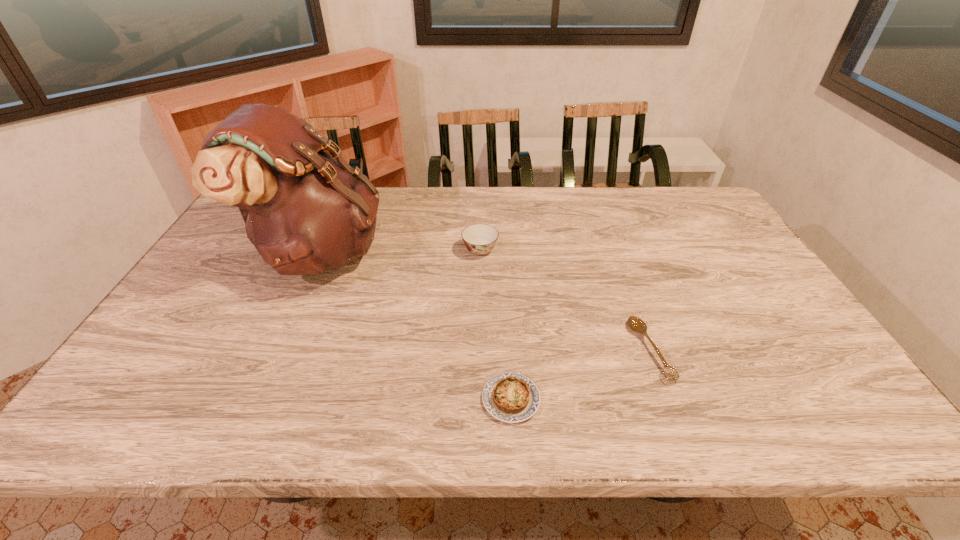
The image size is (960, 540). In order to click on free space between the second tallest object and the satchel in this screenshot , I will do `click(400, 252)`.

Identify the location of free point between the soup bowl and the ladle. This screenshot has height=540, width=960. (564, 300).

At what (x,y) coordinates should I click in order to perform the action: click on free space between the quiche and the third shortest object. Please return your answer as a coordinate pair (x, y). The height and width of the screenshot is (540, 960). Looking at the image, I should click on (495, 325).

This screenshot has width=960, height=540. What are the coordinates of `vacant space that's between the rightmost object and the third shortest object` in the screenshot? It's located at (564, 300).

You are a GUI agent. You are given a task and a screenshot of the screen. Output one action in this format:
    pyautogui.click(x=<x>, y=<y>)
    Task: Click on the free point between the tallest object and the soup bowl
    
    Given the screenshot: What is the action you would take?
    pyautogui.click(x=400, y=252)

Locate an element on the screen. free space between the third shortest object and the rightmost object is located at coordinates (564, 300).

Locate an element on the screen. vacant area that lies between the soup bowl and the quiche is located at coordinates (495, 325).

Find the location of a particular element. The image size is (960, 540). blank region between the quiche and the soup bowl is located at coordinates (495, 325).

This screenshot has width=960, height=540. Find the location of `object that stands as the second closest to the rightmost object`. object that stands as the second closest to the rightmost object is located at coordinates (480, 239).

Identify which object is the second nearest to the rightmost object. Please provide its 2D coordinates. Your answer should be formatted as a tuple, i.e. [(x, y)], where the tuple contains the x and y coordinates of a point satisfying the conditions above.

[(480, 239)]